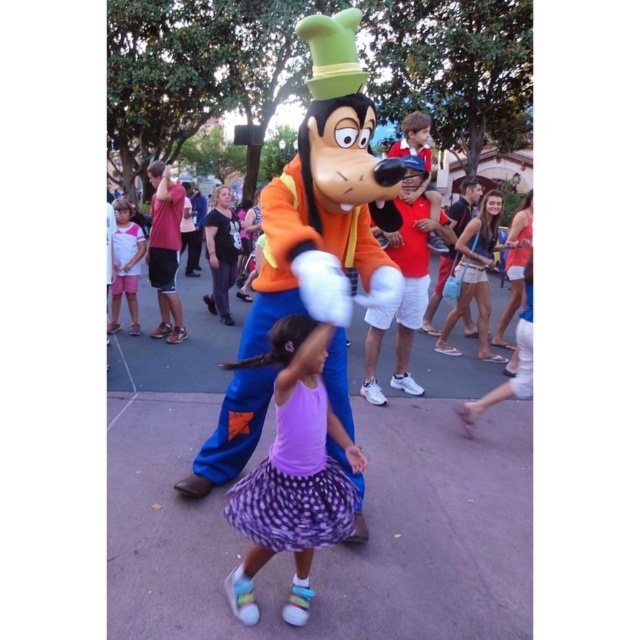
Is point (291, 545) behind point (172, 211)?

No, (291, 545) is in front of (172, 211).

Between point (340, 484) and point (173, 212), which one is positioned in front?

Point (340, 484) is more forward.

At what (x,y) coordinates should I click in order to perform the action: click on purple dotted skirt at center. Please return your answer as a coordinate pair (x, y). The height and width of the screenshot is (640, 640). Looking at the image, I should click on (294, 483).

Who is more forward, (x=232, y=506) or (x=129, y=209)?

Point (x=232, y=506)

This screenshot has width=640, height=640. Find the location of `purple dotted skirt at center`. purple dotted skirt at center is located at coordinates (294, 483).

Does point (308, 260) come closer to viewer compared to point (170, 250)?

Yes, it is.

Who is positioned more to the right, matte orange costume at center or matte red shirt at left?

matte orange costume at center

Is point (337, 246) more distant than point (179, 339)?

No, (337, 246) is in front of (179, 339).

At what (x,y) coordinates should I click in order to perform the action: click on matte orange costume at center. Please return your answer as a coordinate pair (x, y). Image resolution: width=640 pixels, height=640 pixels. Looking at the image, I should click on (326, 209).